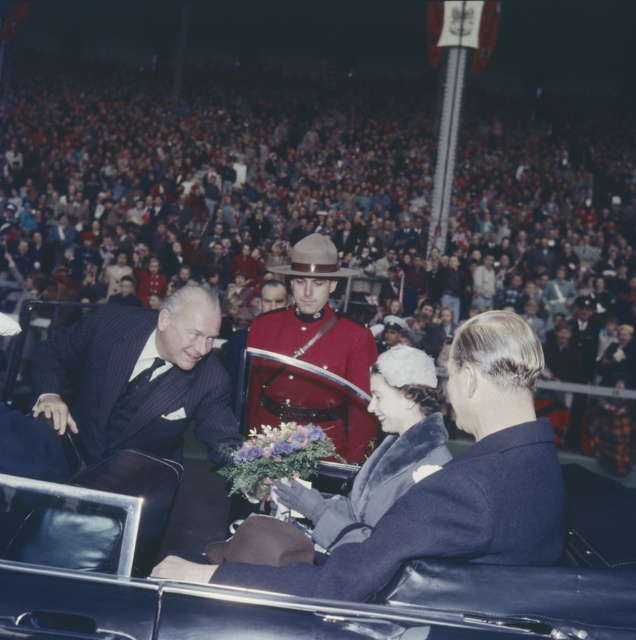
You are a photographer at the event, and you need to capture a photo of the dark blue pinstripe suit at center and the purple silk bouquet at center. Which object should you focus on first if you want to ensure both are in focus without adjusting the camera settings?

The dark blue pinstripe suit at center is located above the purple silk bouquet at center, so focusing on the dark blue pinstripe suit at center first would ensure both are in focus since it is closer to the camera.

You are a photographer at the event and need to capture a clear shot of both the dark blue pinstripe suit at center and the purple silk bouquet at center. Which object should you focus on first to ensure both are in the frame?

You should focus on the dark blue pinstripe suit at center first since it is closer to the viewer than the purple silk bouquet at center, ensuring both will be in the frame when properly focused.